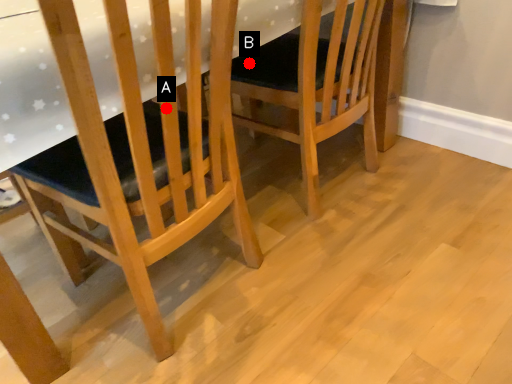
Question: Two points are circled on the image, labeled by A and B beside each circle. Which point is farther to the camera?

Choices:
 (A) A is further
 (B) B is further

Answer: (B)